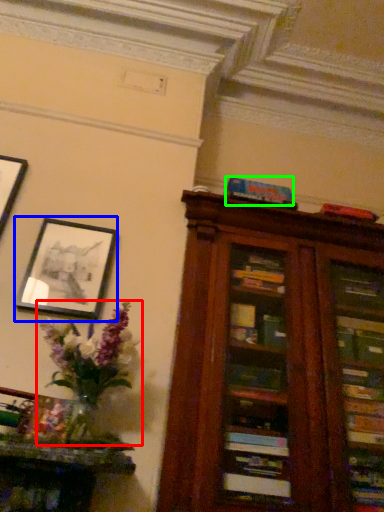
Question: Based on their relative distances, which object is farther from floral arrangement (highlighted by a red box)? Choose from picture frame (highlighted by a blue box) and paperback book (highlighted by a green box).

Choices:
 (A) picture frame
 (B) paperback book

Answer: (B)